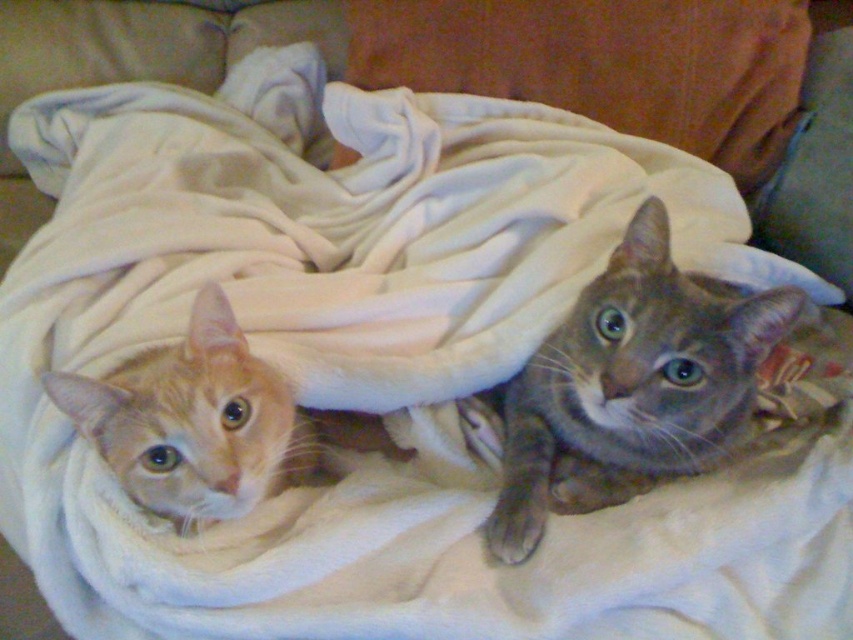
Is orange fur cat at left wider than gray fur cat at center?

Yes.

This screenshot has width=853, height=640. What are the coordinates of `orange fur cat at left` in the screenshot? It's located at click(206, 422).

Is point (693, 444) farther from camera compared to point (793, 202)?

No, (693, 444) is closer to viewer.

Is gray soft fur cat at upper right above gray fur cat at center?

Actually, gray soft fur cat at upper right is below gray fur cat at center.

Where is `gray soft fur cat at upper right`? Image resolution: width=853 pixels, height=640 pixels. gray soft fur cat at upper right is located at coordinates (631, 385).

Is point (660, 426) in front of point (132, 442)?

No, it is behind (132, 442).

Does gray soft fur cat at upper right have a greater width compared to orange fur cat at left?

No, gray soft fur cat at upper right is not wider than orange fur cat at left.

The image size is (853, 640). Find the location of `gray soft fur cat at upper right`. gray soft fur cat at upper right is located at coordinates (631, 385).